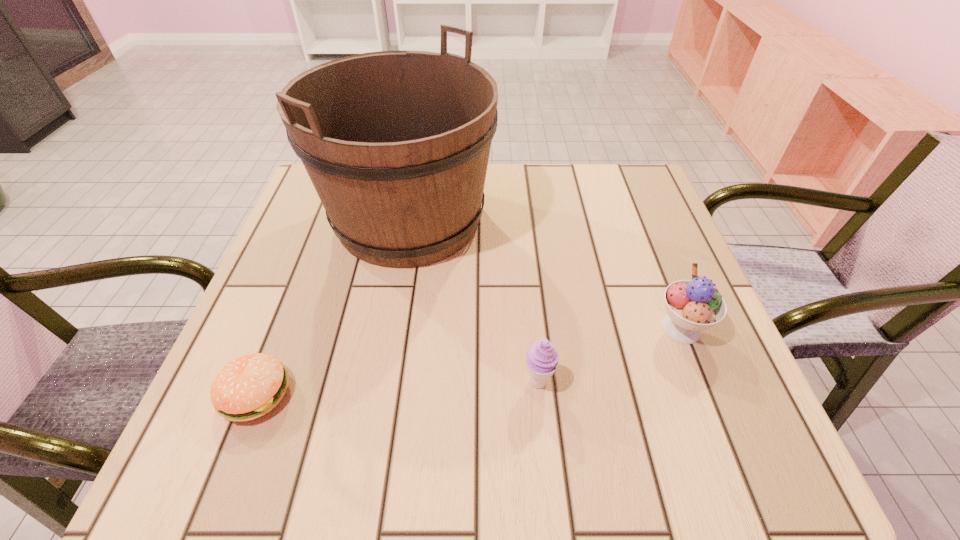
Image resolution: width=960 pixels, height=540 pixels. In the image, there is a desktop. Identify the location of vacant space at the left edge. (295, 321).

Locate an element on the screen. This screenshot has width=960, height=540. vacant point at the right edge is located at coordinates (645, 295).

Image resolution: width=960 pixels, height=540 pixels. In order to click on vacant space at the near left corner in this screenshot , I will do `click(219, 437)`.

This screenshot has height=540, width=960. In the image, there is a desktop. In order to click on free region at the far right corner in this screenshot , I will do `click(620, 187)`.

The image size is (960, 540). I want to click on vacant area at the near right corner of the desktop, so click(x=709, y=428).

This screenshot has width=960, height=540. In order to click on free space that is in between the tallest object and the third nearest object in this screenshot , I will do `click(545, 274)`.

Identify the location of vacant space in between the shortest object and the bucket. The image size is (960, 540). (332, 307).

Image resolution: width=960 pixels, height=540 pixels. Find the location of `free space that is in between the farthest object and the patty`. free space that is in between the farthest object and the patty is located at coordinates (332, 307).

You are a GUI agent. You are given a task and a screenshot of the screen. Output one action in this format:
    pyautogui.click(x=<x>, y=<y>)
    Task: Click on the free area in between the shortest object and the farthest object
    
    Given the screenshot: What is the action you would take?
    pyautogui.click(x=332, y=307)

Find the location of a particular element. Image resolution: width=960 pixels, height=540 pixels. free space between the third object from left to right and the shortest object is located at coordinates (396, 388).